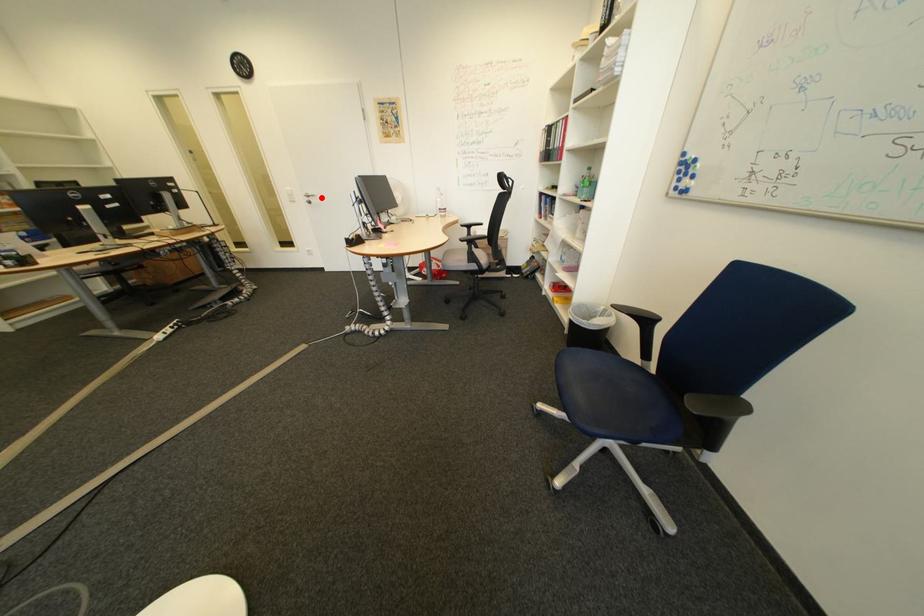
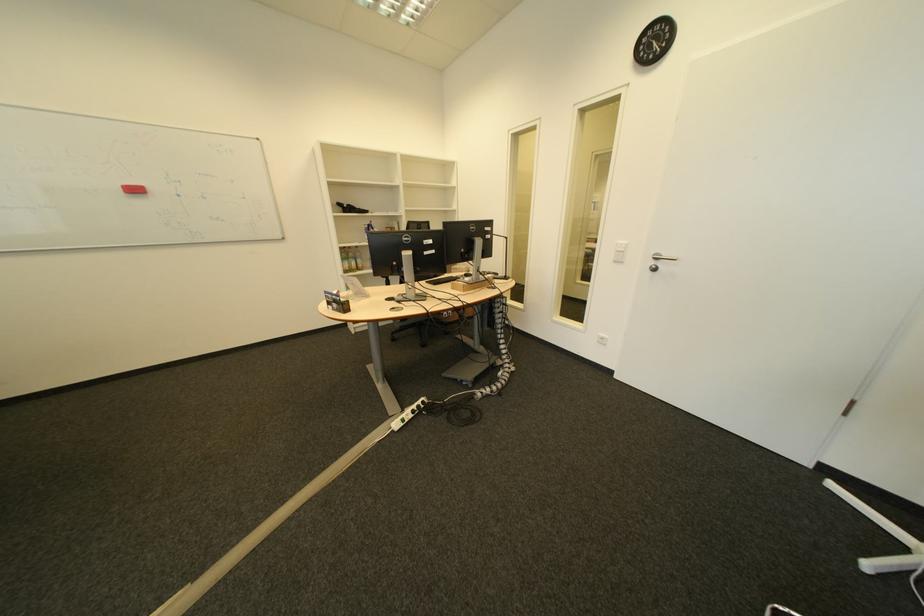
The point at the highlighted location is marked in the first image. Where is the corresponding point in the second image?

(669, 260)